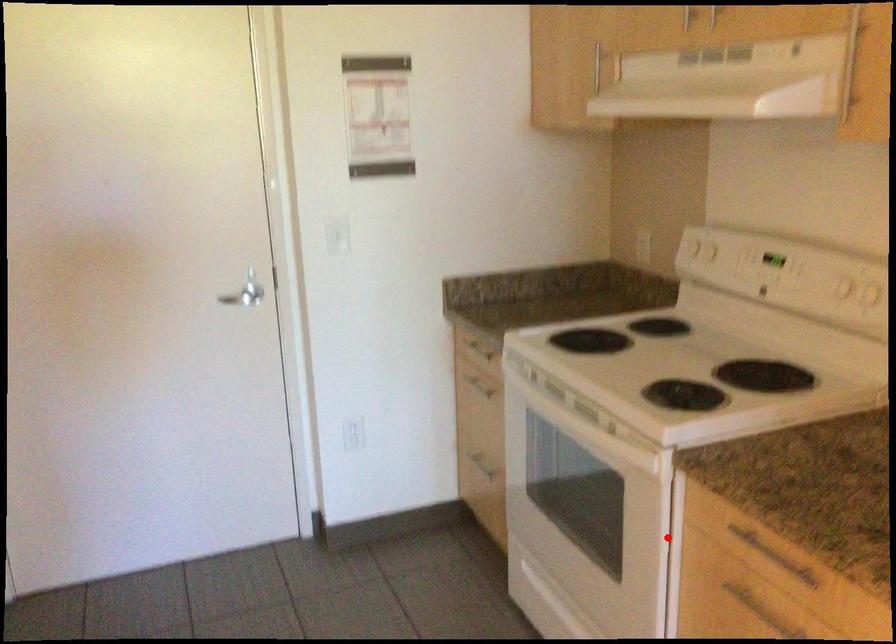
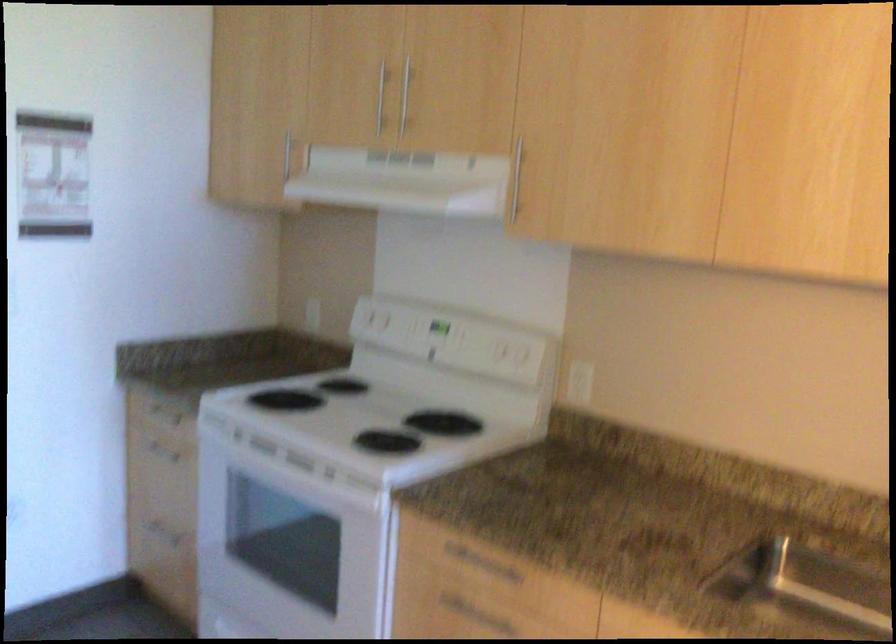
Question: A red point is marked in image1. In image2, is the corresponding 3D point closer to the camera or farther? Reply with the corresponding letter.

Choices:
 (A) The corresponding 3D point is closer.
 (B) The corresponding 3D point is farther.

Answer: (B)